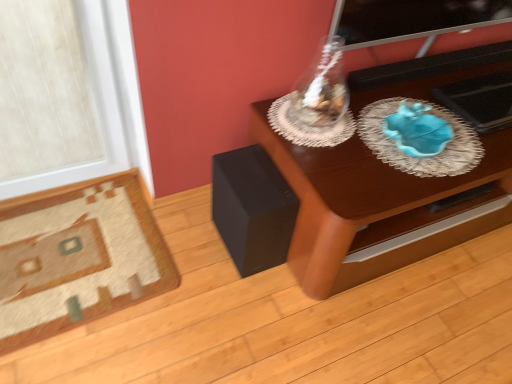
Question: From the image's perspective, is wooden table at center located above or below black matte speaker at lower left?

Choices:
 (A) below
 (B) above

Answer: (B)

Question: Do you think wooden table at center is within black matte speaker at lower left, or outside of it?

Choices:
 (A) inside
 (B) outside

Answer: (B)

Question: Based on their relative distances, which object is farther from the black matte speaker at lower left?

Choices:
 (A) blue glass plate at right
 (B) carpeted rug at lower left
 (C) wooden table at center
 (D) transparent glass vase at upper center

Answer: (A)

Question: Which is farther from the blue glass plate at right?

Choices:
 (A) transparent glass vase at upper center
 (B) carpeted rug at lower left
 (C) black matte speaker at lower left
 (D) wooden table at center

Answer: (B)